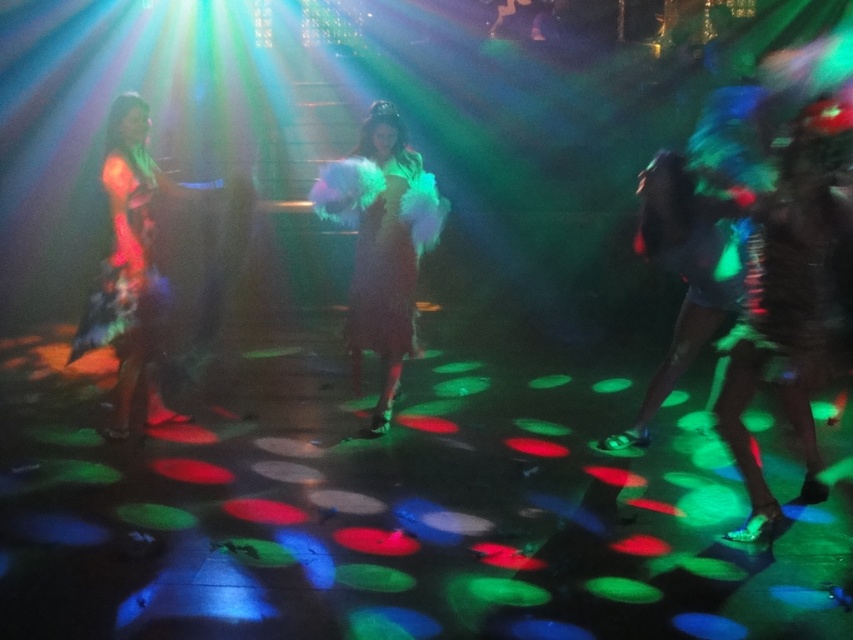
You are a photographer at the nightclub and want to take a photo of the fuzzy black dress at right and the shiny metallic dress at left. Which dress is closer to the camera?

The fuzzy black dress at right is positioned under the shiny metallic dress at left, so the fuzzy black dress at right is closer to the camera.

Based on the photo, you are standing at the entrance of the nightclub and want to locate the shiny metallic dress at left. According to the coordinates provided, where should you look relative to the center of the image?

The shiny metallic dress at left is located at coordinates point (x=132, y=272), which is to the left and slightly below the center of the image.